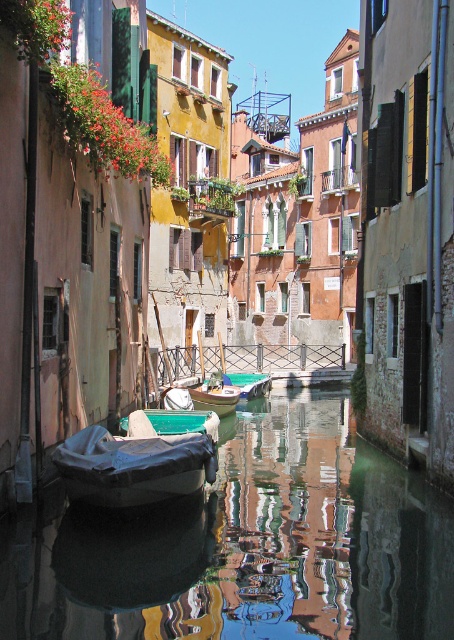
Between smooth reflective water at center and teal plastic boat at center, which one has less height?

teal plastic boat at center is shorter.

Is smooth reflective water at center positioned before teal plastic boat at center?

Yes.

Does point (440, 500) lie in front of point (171, 413)?

Yes, it is.

Image resolution: width=454 pixels, height=640 pixels. I want to click on smooth reflective water at center, so click(246, 545).

Which is more to the left, smooth reflective water at center or wooden boat at center?

wooden boat at center is more to the left.

Where is `smooth reflective water at center`? The width and height of the screenshot is (454, 640). smooth reflective water at center is located at coordinates (246, 545).

Is point (228, 602) farther from viewer compared to point (221, 381)?

No.

The height and width of the screenshot is (640, 454). What are the coordinates of `smooth reflective water at center` in the screenshot? It's located at (246, 545).

Which is behind, point (153, 413) or point (205, 397)?

Positioned behind is point (205, 397).

Is point (152, 426) in front of point (202, 387)?

Yes, it is in front of point (202, 387).

Find the location of a particular element. The height and width of the screenshot is (640, 454). teal plastic boat at center is located at coordinates (183, 420).